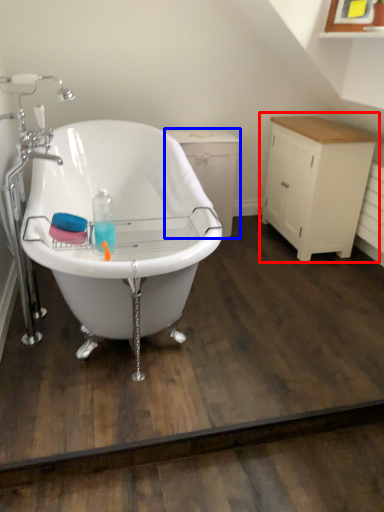
Question: Which object appears farthest to the camera in this image, cabinetry (highlighted by a red box) or dresser (highlighted by a blue box)?

Choices:
 (A) cabinetry
 (B) dresser

Answer: (B)